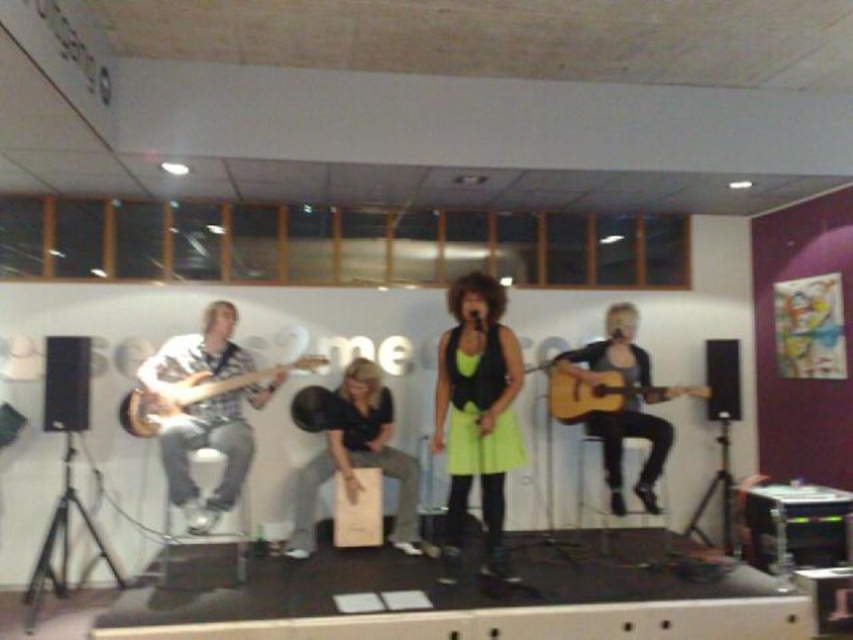
From the picture: You are a photographer in the audience, and you want to capture a photo that includes both the matte black guitar at left and the acoustic wood guitar at center. Based on their positions, which guitar should you focus on first to ensure both are in frame?

The matte black guitar at left is below the acoustic wood guitar at center, so you should focus on the acoustic wood guitar at center first to ensure both are in frame.

You are a photographer positioned at the back of the stage. You want to capture a clear shot of the acoustic wood guitar at center without the matte black guitar at left blocking it. How should you adjust your camera angle?

The matte black guitar at left is in front of the acoustic wood guitar at center. To avoid blocking, you should adjust your camera angle to shoot from behind the matte black guitar at left so that the acoustic wood guitar at center becomes visible behind it.